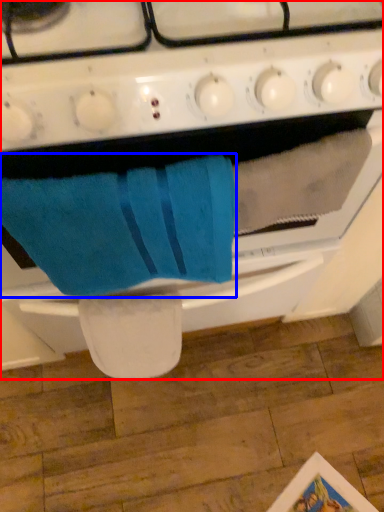
Question: Which object appears farthest to the camera in this image, oven (highlighted by a red box) or bath towel (highlighted by a blue box)?

Choices:
 (A) oven
 (B) bath towel

Answer: (B)